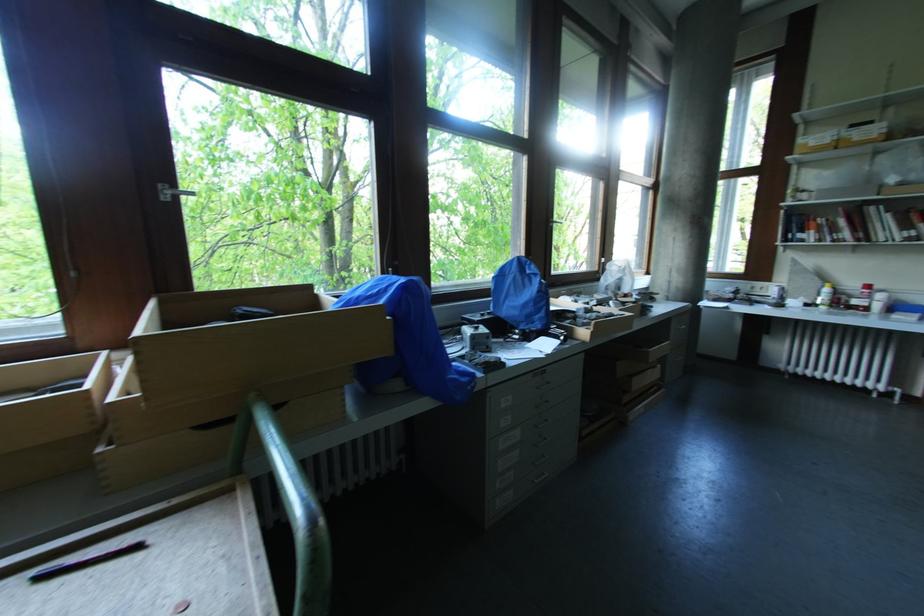
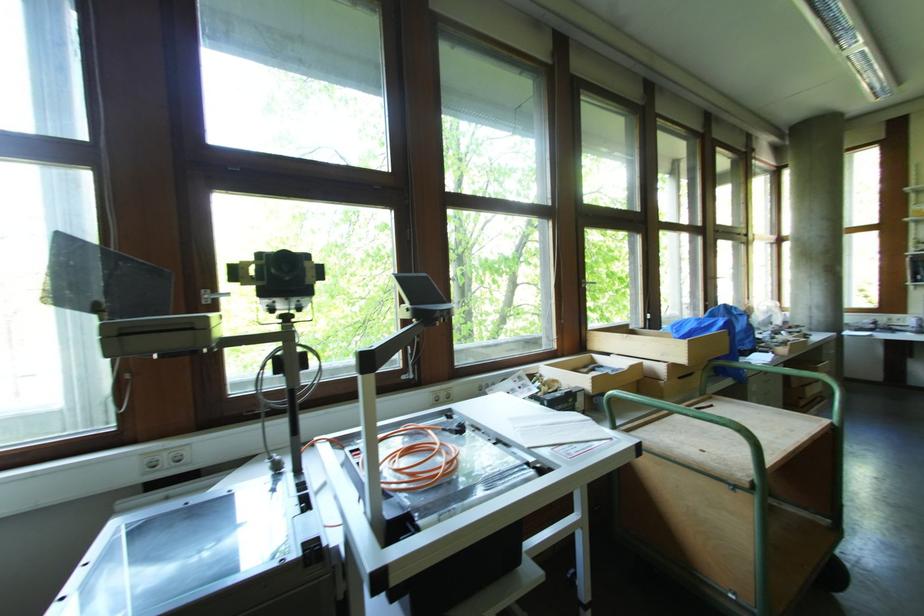
Looking at this image, which direction would the cameraman need to move to produce the second image?

The cameraman moved toward left, backward.